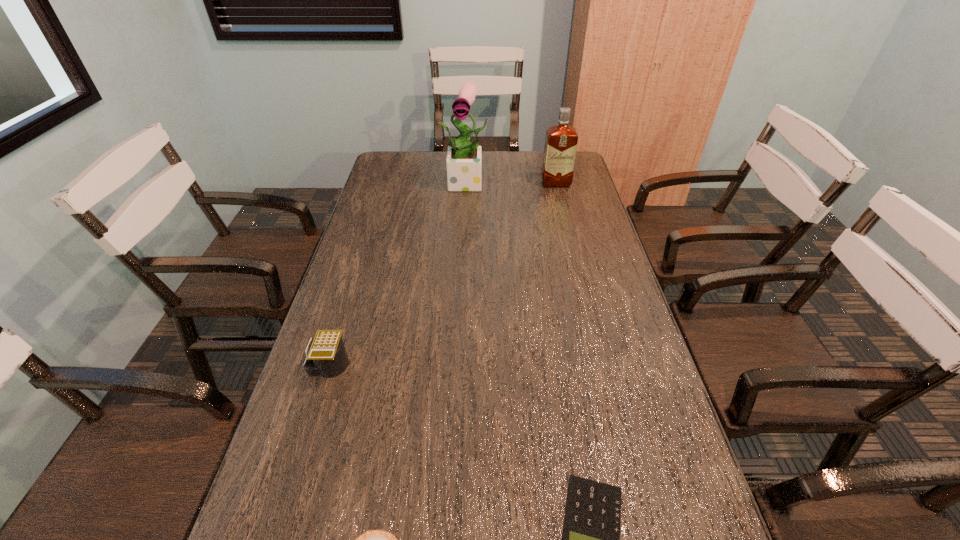
This screenshot has height=540, width=960. Find the location of `flower arrangement`. flower arrangement is located at coordinates (463, 162).

Find the location of `liquor`. liquor is located at coordinates (561, 140).

Locate an element on the screen. Image resolution: width=960 pixels, height=540 pixels. the third farthest object is located at coordinates click(x=326, y=356).

Identify the location of the left calculator. The height and width of the screenshot is (540, 960). (326, 356).

You are a GUI agent. You are given a task and a screenshot of the screen. Output one action in this format:
    pyautogui.click(x=<x>, y=<y>)
    Task: Click on the free location located on the front-facing side of the flower arrangement
    
    Given the screenshot: What is the action you would take?
    pyautogui.click(x=467, y=232)

Locate an element on the screen. vacant area located 0.130m on the front label of the liquor is located at coordinates (562, 207).

Find the location of `blank space located on the right of the taller calculator`. blank space located on the right of the taller calculator is located at coordinates (483, 365).

The image size is (960, 540). I want to click on flower arrangement present at the far edge, so click(x=463, y=162).

I want to click on liquor that is at the far edge, so click(561, 140).

Image resolution: width=960 pixels, height=540 pixels. In order to click on object positioned at the left edge in this screenshot , I will do `click(326, 356)`.